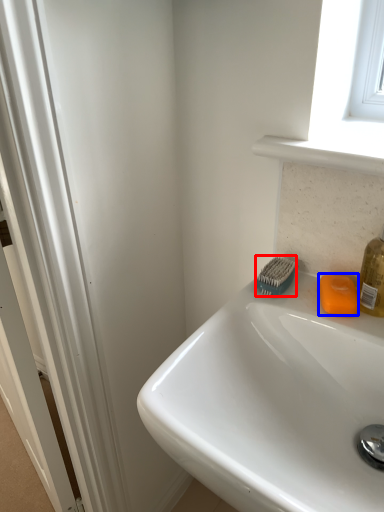
Question: Among these objects, which one is nearest to the camera, brush (highlighted by a red box) or soap (highlighted by a blue box)?

Choices:
 (A) brush
 (B) soap

Answer: (B)